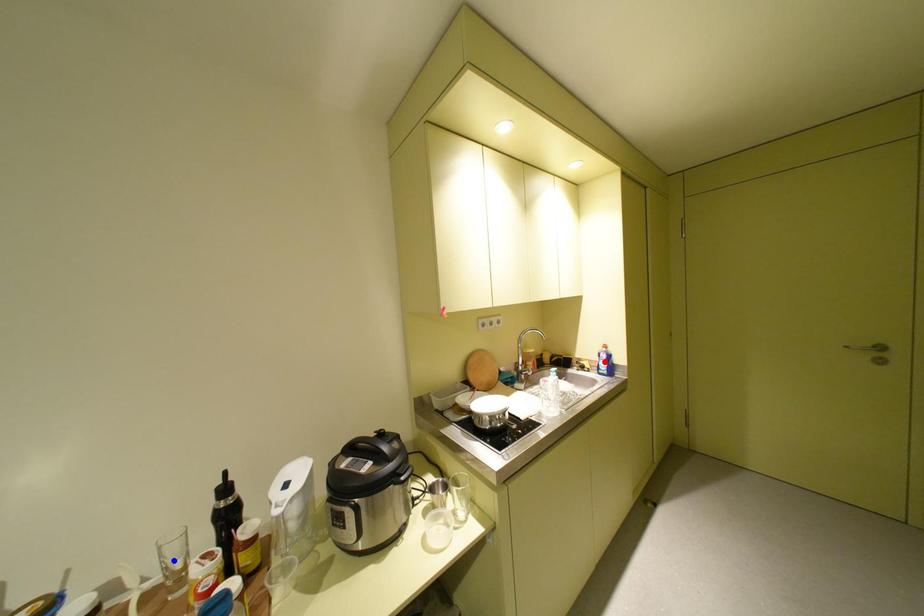
Question: Two points are marked on the image. Which point is closer to the camera?

Choices:
 (A) Blue point is closer.
 (B) Red point is closer.

Answer: (A)